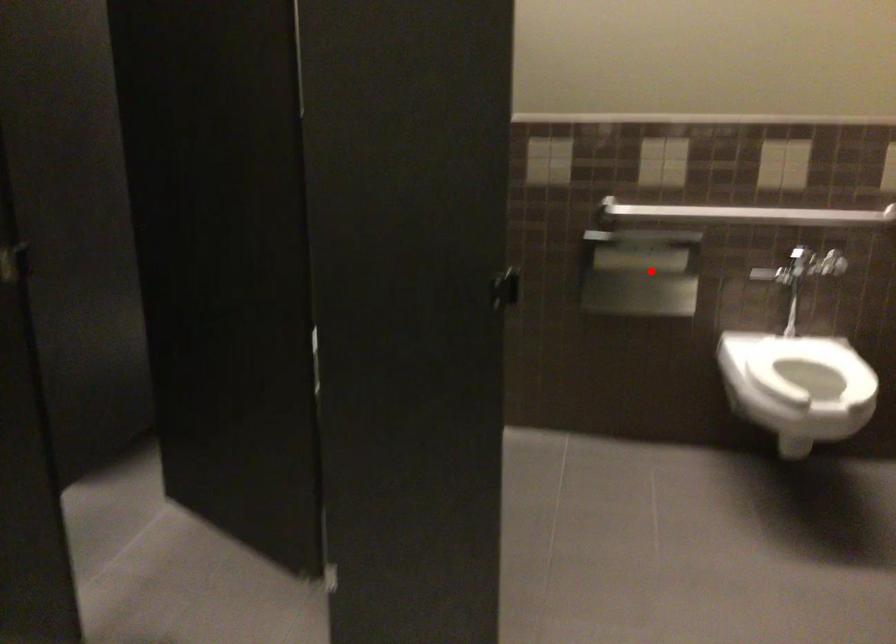
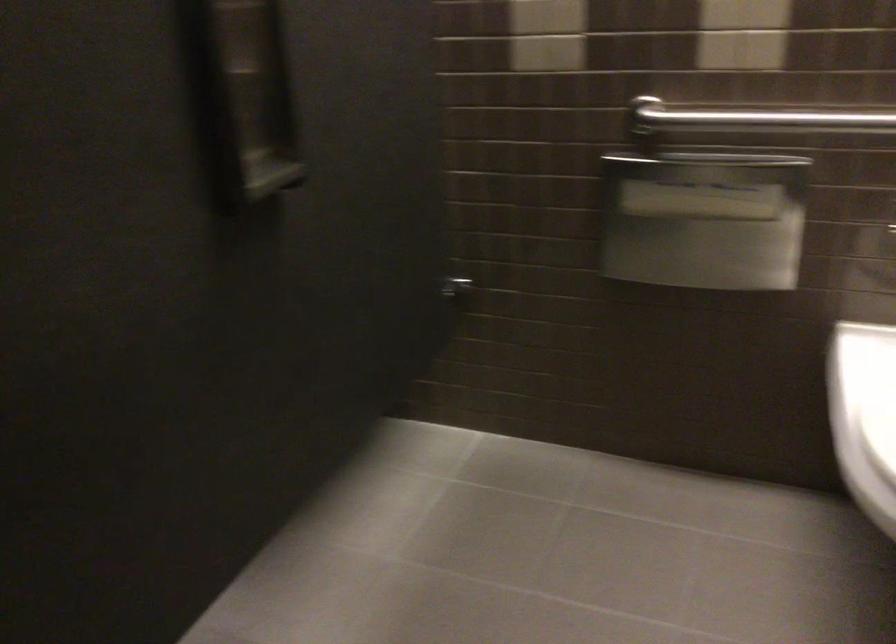
Question: I am providing you with two images of the same scene from different viewpoints. In image1, a red point is highlighted. Considering the same 3D point in image2, which of the following is correct?

Choices:
 (A) It is closer
 (B) It is farther

Answer: (A)